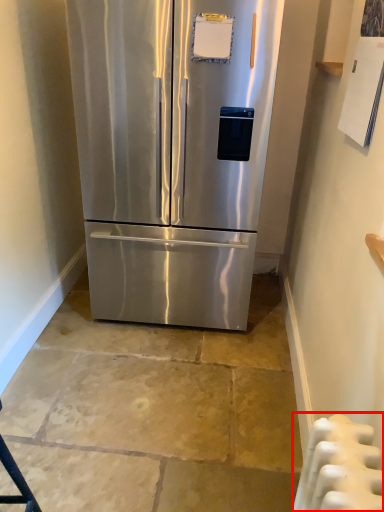
Question: Where is radiator (annotated by the red box) located in relation to refrigerator in the image?

Choices:
 (A) left
 (B) right

Answer: (B)